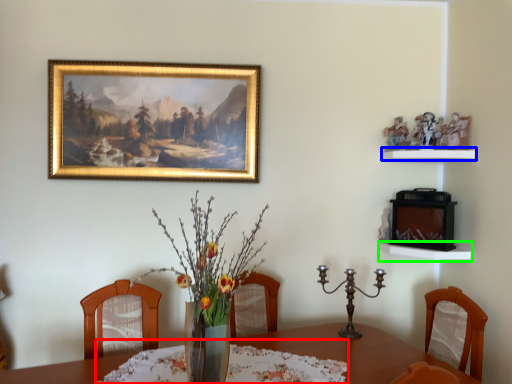
Question: Which object is the farthest from tablecloth (highlighted by a red box)? Choose among these: shelf (highlighted by a blue box) or shelf (highlighted by a green box).

Choices:
 (A) shelf
 (B) shelf

Answer: (A)